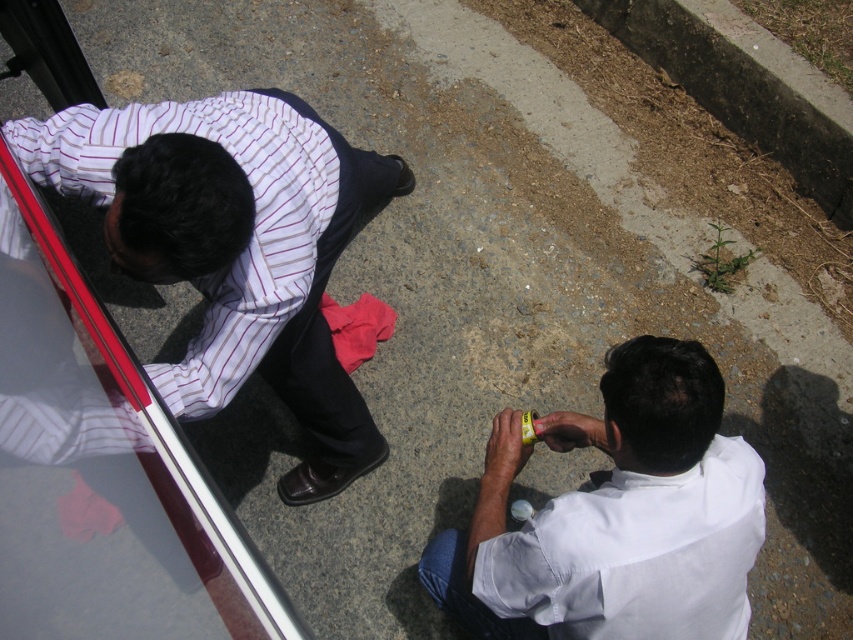
You are a fashion designer observing two people in the scene. You notice the striped cotton shirt at left and the white matte shirt at lower right. Which of these two shirts has a larger size?

The striped cotton shirt at left is larger in size than the white matte shirt at lower right.